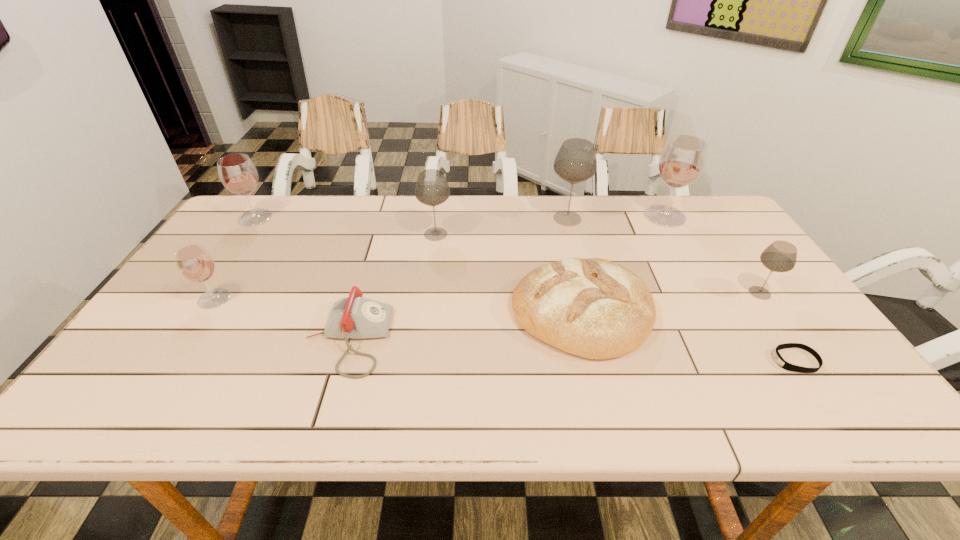
Find the location of `free location at the left edge`. free location at the left edge is located at coordinates (175, 343).

In the image, there is a desktop. Where is `vacant space at the right edge`? The image size is (960, 540). vacant space at the right edge is located at coordinates (715, 246).

Find the location of a particular element. This screenshot has width=960, height=540. vacant space at the near left corner is located at coordinates coord(165,389).

Image resolution: width=960 pixels, height=540 pixels. I want to click on vacant area at the far right corner, so click(x=708, y=207).

The height and width of the screenshot is (540, 960). I want to click on free space between the shortest object and the rightmost red wineglass, so click(730, 288).

Find the location of `vacant area that lies between the rightmost gray wineglass and the shortest object`. vacant area that lies between the rightmost gray wineglass and the shortest object is located at coordinates (778, 327).

Locate an element on the screen. The image size is (960, 540). free area in between the second biggest red wineglass and the smallest red wineglass is located at coordinates (234, 258).

The image size is (960, 540). What are the coordinates of `free spot between the third wineglass from left to right and the nearest red wineglass` in the screenshot? It's located at (325, 267).

Image resolution: width=960 pixels, height=540 pixels. Identify the location of free space between the second gray wineglass from left to right and the leftmost gray wineglass. (501, 226).

The width and height of the screenshot is (960, 540). I want to click on empty location between the wristband and the smallest gray wineglass, so click(778, 327).